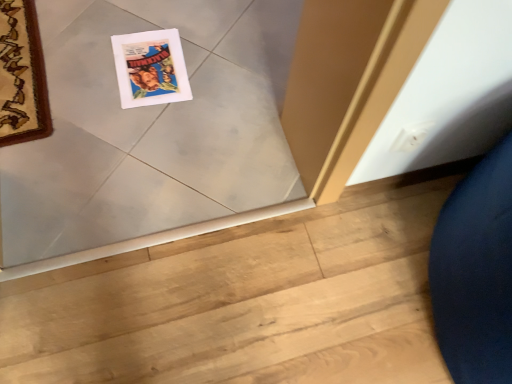
I want to click on wooden floor at lower left, so (246, 304).

Measure the distance between point (344,253) and camera.

Point (344,253) and camera are 3.68 feet apart from each other.

Describe the element at coordinates (246, 304) in the screenshot. I see `wooden floor at lower left` at that location.

Where is `wooden floor at lower left`? wooden floor at lower left is located at coordinates (246, 304).